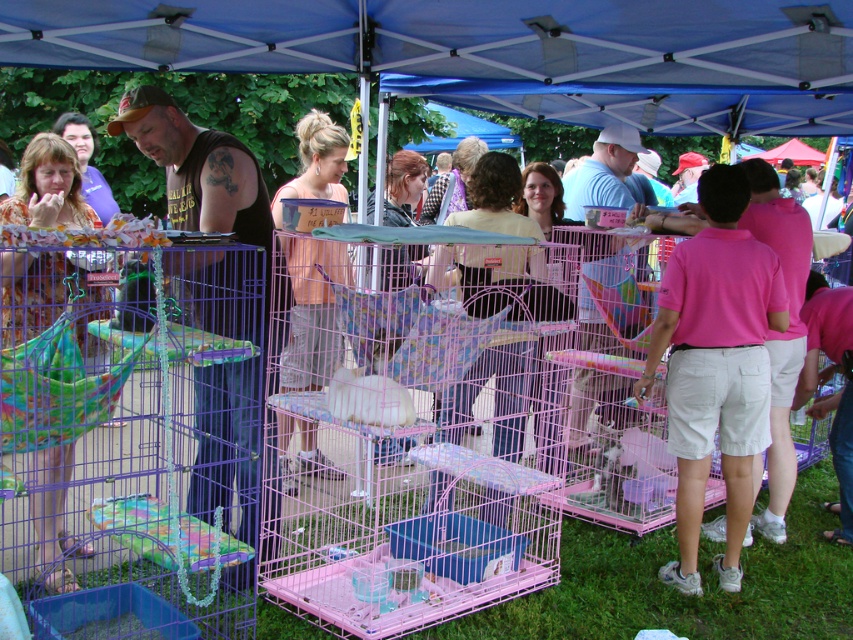
Which of these two, pink cotton shirt at right or black tank top at left, stands shorter?

Standing shorter between the two is pink cotton shirt at right.

You are a GUI agent. You are given a task and a screenshot of the screen. Output one action in this format:
    pyautogui.click(x=<x>, y=<y>)
    Task: Click on the pink cotton shirt at right
    The height and width of the screenshot is (640, 853).
    Given the screenshot: What is the action you would take?
    click(715, 365)

Describe the element at coordinates (48, 188) in the screenshot. I see `floral dress at left` at that location.

Which is in front, point (7, 326) or point (314, 179)?

Point (7, 326) is in front.

This screenshot has height=640, width=853. Find the location of `floral dress at left`. floral dress at left is located at coordinates [x=48, y=188].

From the picture: Is black tank top at left further to the viewer compared to floral dress at left?

That is False.

Can you confirm if black tank top at left is bigger than floral dress at left?

Yes.

Where is `black tank top at left`? This screenshot has width=853, height=640. black tank top at left is located at coordinates (215, 291).

The height and width of the screenshot is (640, 853). Identify the location of black tank top at left. (215, 291).